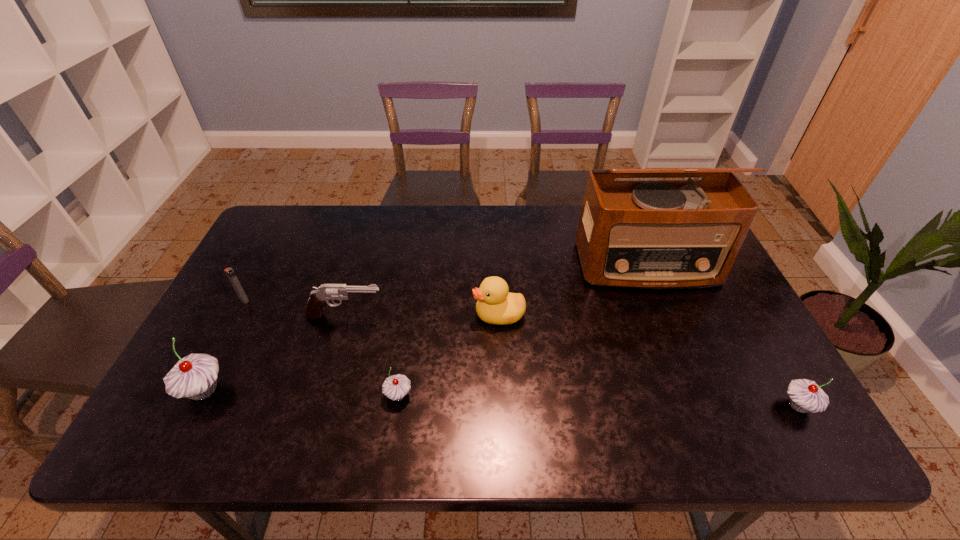
The image size is (960, 540). I want to click on empty space between the third object from right to left and the farthest object, so click(x=573, y=290).

Locate an element on the screen. Image resolution: width=960 pixels, height=540 pixels. vacant area between the fifth object from left to right and the gun is located at coordinates (422, 315).

Identify which object is the fourth nearest to the fifth object from left to right. Please provide its 2D coordinates. Your answer should be formatted as a tuple, i.e. [(x, y)], where the tuple contains the x and y coordinates of a point satisfying the conditions above.

[(195, 376)]

Where is `object that is the second closest to the radio receiver`? object that is the second closest to the radio receiver is located at coordinates (805, 395).

At what (x,y) coordinates should I click in order to perform the action: click on the closest cupcake to the shortest cupcake. Please return your answer as a coordinate pair (x, y). The width and height of the screenshot is (960, 540). Looking at the image, I should click on (195, 376).

Select which cupcake appears as the closest to the second tallest object. Please provide its 2D coordinates. Your answer should be formatted as a tuple, i.e. [(x, y)], where the tuple contains the x and y coordinates of a point satisfying the conditions above.

[(395, 387)]

Locate an element on the screen. vacant position in the image that satisfies the following two spatial constraints: 1. at the beak of the third object from right to left; 2. on the front side of the shortest object is located at coordinates (502, 395).

You are a GUI agent. You are given a task and a screenshot of the screen. Output one action in this format:
    pyautogui.click(x=<x>, y=<y>)
    Task: Click on the free space that satisfies the following two spatial constraints: 1. on the front panel of the tallest object; 2. at the muzzle of the gun
    Image resolution: width=960 pixels, height=540 pixels.
    Given the screenshot: What is the action you would take?
    pyautogui.click(x=668, y=316)

You are a GUI agent. You are given a task and a screenshot of the screen. Output one action in this format:
    pyautogui.click(x=<x>, y=<y>)
    Task: Click on the free space that satisfies the following two spatial constraints: 1. on the front panel of the radio receiver; 2. on the right side of the rightmost cupcake
    Image resolution: width=960 pixels, height=540 pixels.
    Given the screenshot: What is the action you would take?
    pyautogui.click(x=705, y=406)